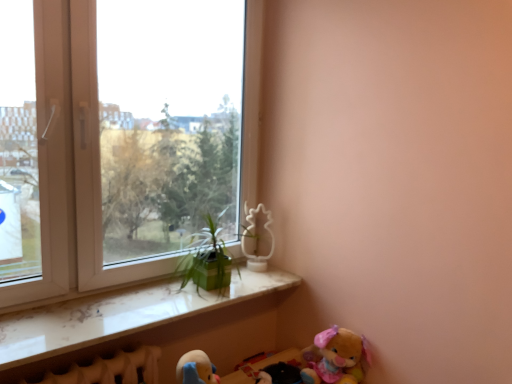
Question: Can you confirm if white marble window sill at lower left is smaller than white plastic window at upper left?

Choices:
 (A) yes
 (B) no

Answer: (A)

Question: From the image's perspective, is white marble window sill at lower left above white plastic window at upper left?

Choices:
 (A) no
 (B) yes

Answer: (A)

Question: From a real-world perspective, does white marble window sill at lower left stand above white plastic window at upper left?

Choices:
 (A) no
 (B) yes

Answer: (A)

Question: Is white marble window sill at lower left facing away from white plastic window at upper left?

Choices:
 (A) yes
 (B) no

Answer: (B)

Question: Is white marble window sill at lower left shorter than white plastic window at upper left?

Choices:
 (A) yes
 (B) no

Answer: (A)

Question: Is white matte pineapple at upper center, positioned as the second toy in right-to-left order, taller or shorter than fluffy plush bear at lower right, which is the 2th toy in top-to-bottom order?

Choices:
 (A) tall
 (B) short

Answer: (A)

Question: From the image's perspective, is white matte pineapple at upper center, the 2th toy in the front-to-back sequence, positioned above or below fluffy plush bear at lower right, positioned as the second toy in left-to-right order?

Choices:
 (A) below
 (B) above

Answer: (B)

Question: Does point (266, 264) appear closer or farther from the camera than point (343, 344)?

Choices:
 (A) farther
 (B) closer

Answer: (A)

Question: Is white matte pineapple at upper center, positioned as the second toy in right-to-left order, to the left or to the right of fluffy plush bear at lower right, which is the 2th toy in top-to-bottom order, in the image?

Choices:
 (A) right
 (B) left

Answer: (B)

Question: Do you think white plastic window at upper left is within white marble window sill at lower left, or outside of it?

Choices:
 (A) inside
 (B) outside

Answer: (B)

Question: Is white plastic window at upper left bigger or smaller than white marble window sill at lower left?

Choices:
 (A) small
 (B) big

Answer: (B)

Question: Considering the positions of white plastic window at upper left and white marble window sill at lower left in the image, is white plastic window at upper left wider or thinner than white marble window sill at lower left?

Choices:
 (A) thin
 (B) wide

Answer: (A)

Question: Is point (42, 294) positioned closer to the camera than point (53, 344)?

Choices:
 (A) closer
 (B) farther

Answer: (B)

Question: Is fluffy plush bear at lower right, the first toy when ordered from right to left, bigger or smaller than white matte pineapple at upper center, the 1th toy from the left?

Choices:
 (A) small
 (B) big

Answer: (B)

Question: Is fluffy plush bear at lower right, arranged as the second toy when viewed from the back, situated inside white matte pineapple at upper center, which is the 1th toy in top-to-bottom order, or outside?

Choices:
 (A) outside
 (B) inside

Answer: (A)